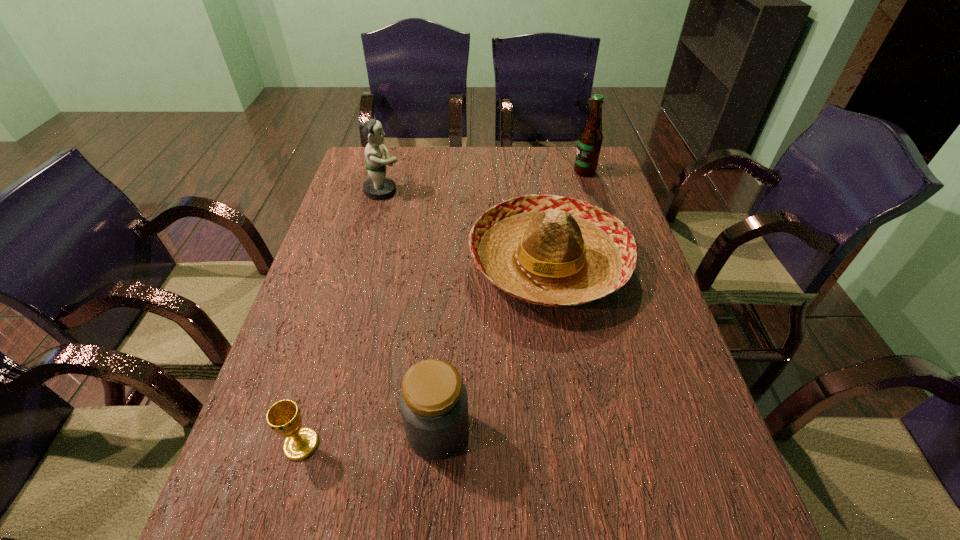
Identify the location of vacant space that is in between the figurine and the sombrero. Image resolution: width=960 pixels, height=540 pixels. (467, 227).

Where is `free space between the jar and the sombrero`? This screenshot has width=960, height=540. free space between the jar and the sombrero is located at coordinates (493, 347).

The width and height of the screenshot is (960, 540). I want to click on object identified as the closest to the chalice, so click(433, 402).

This screenshot has width=960, height=540. I want to click on object that is the third nearest to the jar, so click(378, 186).

Locate an element on the screen. The width and height of the screenshot is (960, 540). free spot that satisfies the following two spatial constraints: 1. on the front-facing side of the fourth nearest object; 2. on the back side of the third nearest object is located at coordinates (364, 262).

Where is `vacant position in the image that satisfies the following two spatial constraints: 1. on the front-facing side of the third farthest object; 2. on the left side of the second farthest object`? This screenshot has height=540, width=960. vacant position in the image that satisfies the following two spatial constraints: 1. on the front-facing side of the third farthest object; 2. on the left side of the second farthest object is located at coordinates (364, 262).